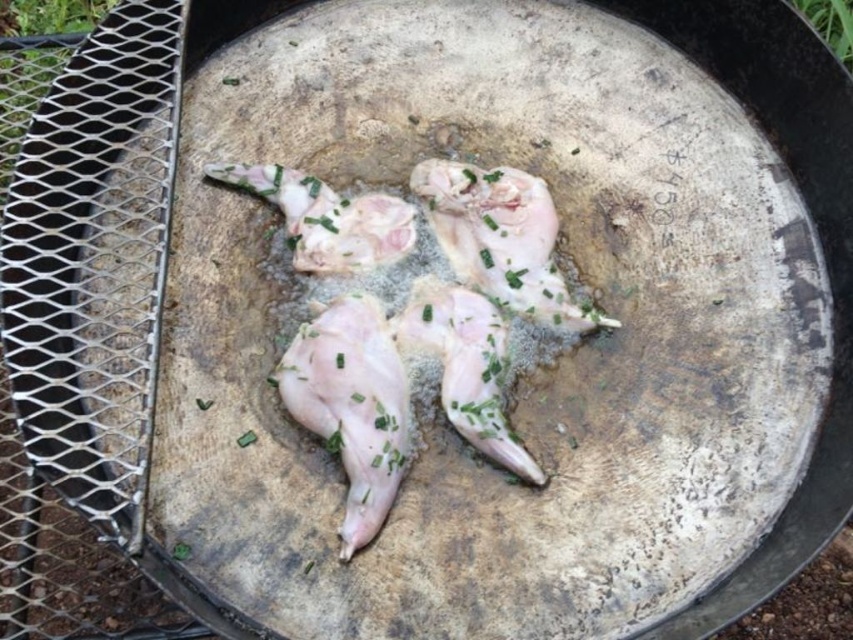
Question: Is pink raw chicken at center bigger than pale pink raw chicken at center?

Choices:
 (A) yes
 (B) no

Answer: (A)

Question: Which of the following is the farthest from the observer?

Choices:
 (A) pink raw chicken at center
 (B) pale pink raw chicken at center

Answer: (B)

Question: Is pink raw chicken at center above pale pink raw chicken at center?

Choices:
 (A) no
 (B) yes

Answer: (B)

Question: Is pink raw chicken at center to the right of pale pink raw chicken at center from the viewer's perspective?

Choices:
 (A) no
 (B) yes

Answer: (B)